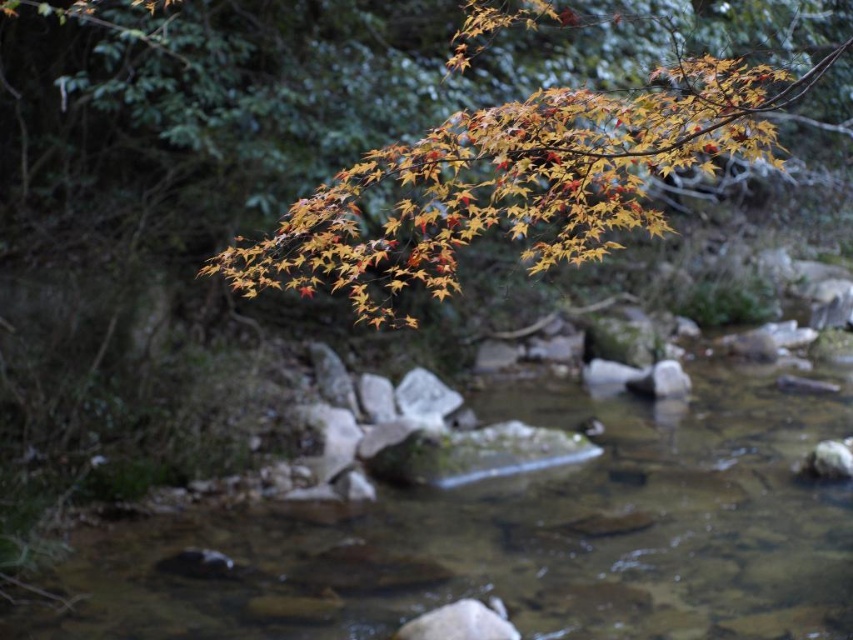
Can you confirm if clear water stream at center is positioned to the right of orange/yellow leaves at upper center?

Incorrect, clear water stream at center is not on the right side of orange/yellow leaves at upper center.

Who is positioned more to the left, clear water stream at center or orange/yellow leaves at upper center?

From the viewer's perspective, clear water stream at center appears more on the left side.

The height and width of the screenshot is (640, 853). What do you see at coordinates (520, 534) in the screenshot?
I see `clear water stream at center` at bounding box center [520, 534].

The height and width of the screenshot is (640, 853). I want to click on clear water stream at center, so click(x=520, y=534).